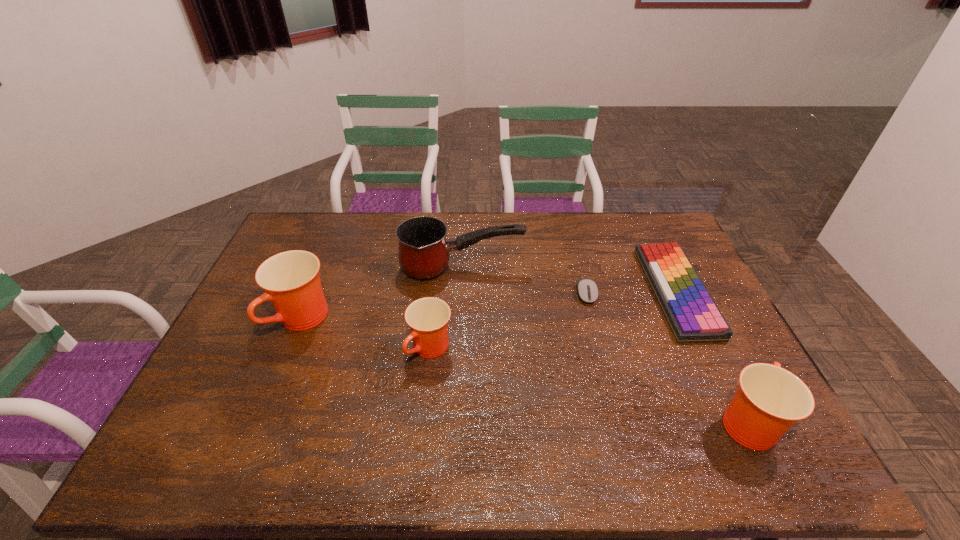
The width and height of the screenshot is (960, 540). I want to click on object located at the far right corner, so click(x=690, y=311).

Identify the location of object at the near right corner. (769, 400).

Identify the location of blank space at the far edge. The image size is (960, 540). (592, 245).

You are a GUI agent. You are given a task and a screenshot of the screen. Output one action in this format:
    pyautogui.click(x=<x>, y=<y>)
    Task: Click on the free space at the near edge
    This screenshot has width=960, height=540.
    Given the screenshot: What is the action you would take?
    pyautogui.click(x=538, y=401)

The image size is (960, 540). Identify the location of vacant space at the far left corner. (300, 245).

Find the location of a particular element. The image size is (960, 540). vacant region at the far right corner is located at coordinates (662, 217).

Where is `free space between the rightmost cup and the fifth tallest object`? This screenshot has height=540, width=960. free space between the rightmost cup and the fifth tallest object is located at coordinates (710, 356).

You are a GUI agent. You are given a task and a screenshot of the screen. Output one action in this format:
    pyautogui.click(x=<x>, y=<y>)
    Task: Click on the vacant area that lies between the saucepan and the nearest cup
    Image resolution: width=960 pixels, height=540 pixels.
    Given the screenshot: What is the action you would take?
    pyautogui.click(x=604, y=345)

Find the location of a particular element. empty space between the second cup from right to left and the shortest object is located at coordinates (509, 321).

Identify the location of free spot between the second tallest cup and the shortest cup. The image size is (960, 540). (588, 385).